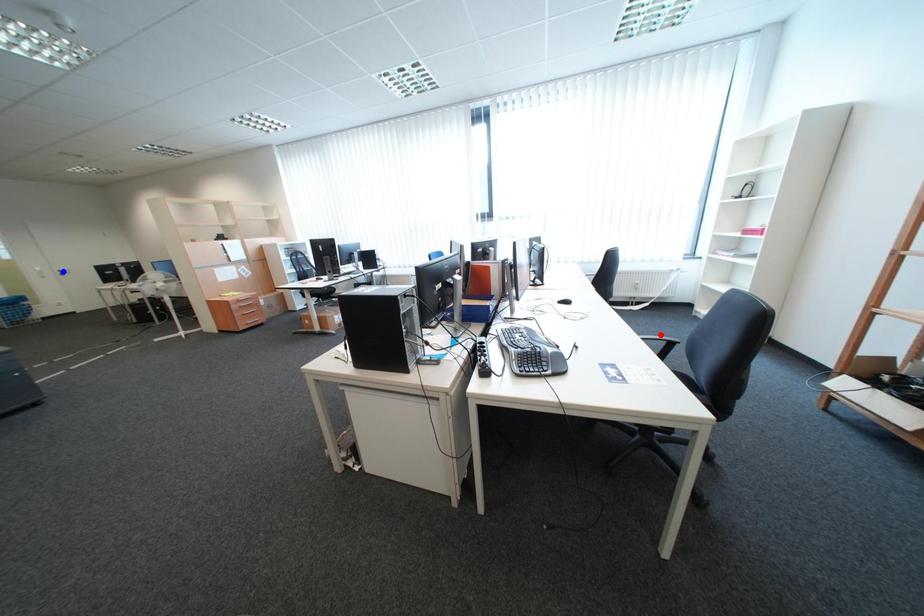
Question: In the image, two points are highlighted. Which point is nearer to the camera? Reply with the corresponding letter.

Choices:
 (A) blue point
 (B) red point

Answer: (B)